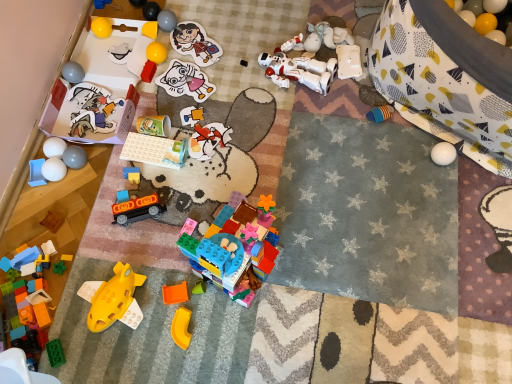
At what (x,y) coordinates should I click in order to perform the action: click on vacant space to the left of orange matte train at center, placed as the 14th toy when sorted from left to right. Please return your answer as a coordinate pair (x, y). The width and height of the screenshot is (512, 384). Looking at the image, I should click on (97, 226).